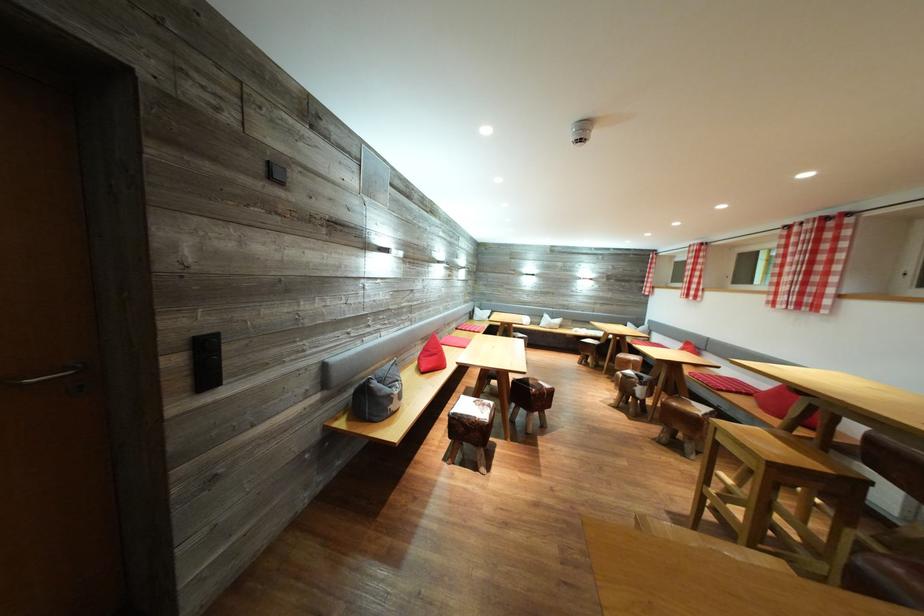
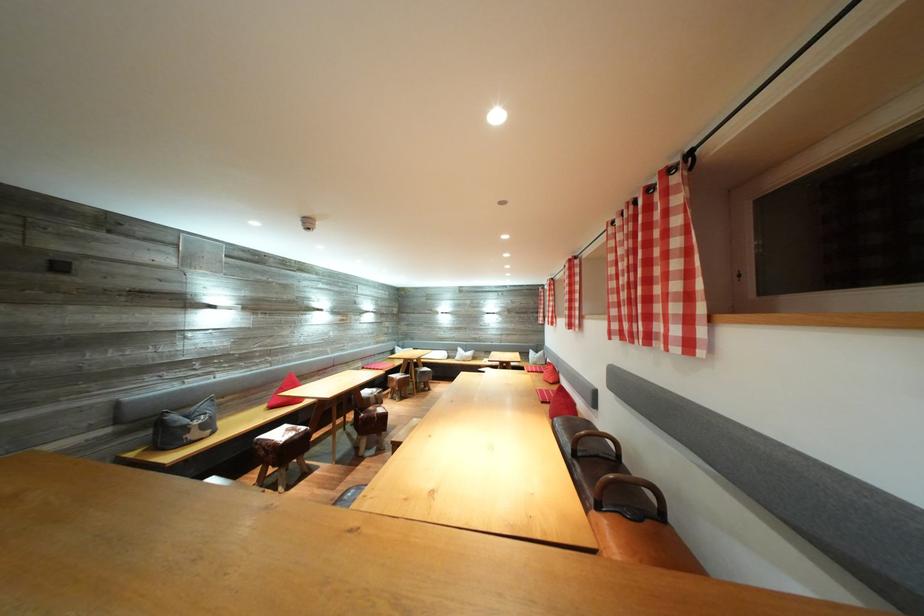
The point at (553, 322) is marked in the first image. Where is the corresponding point in the second image?

(467, 355)